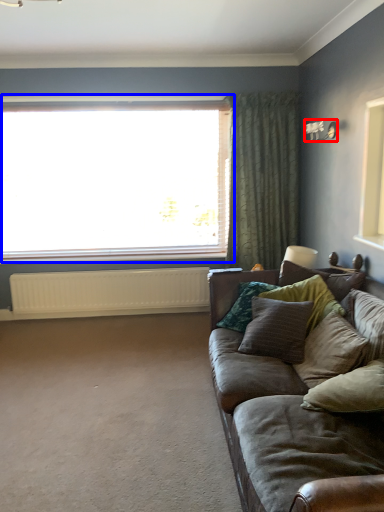
Question: Which point is further to the camera, light fixture (highlighted by a red box) or window (highlighted by a blue box)?

Choices:
 (A) light fixture
 (B) window

Answer: (B)